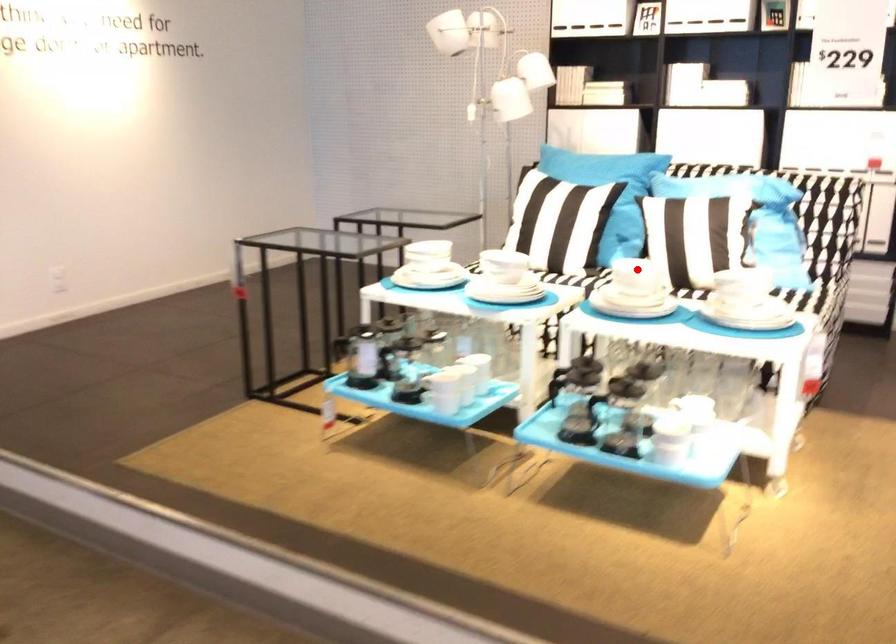
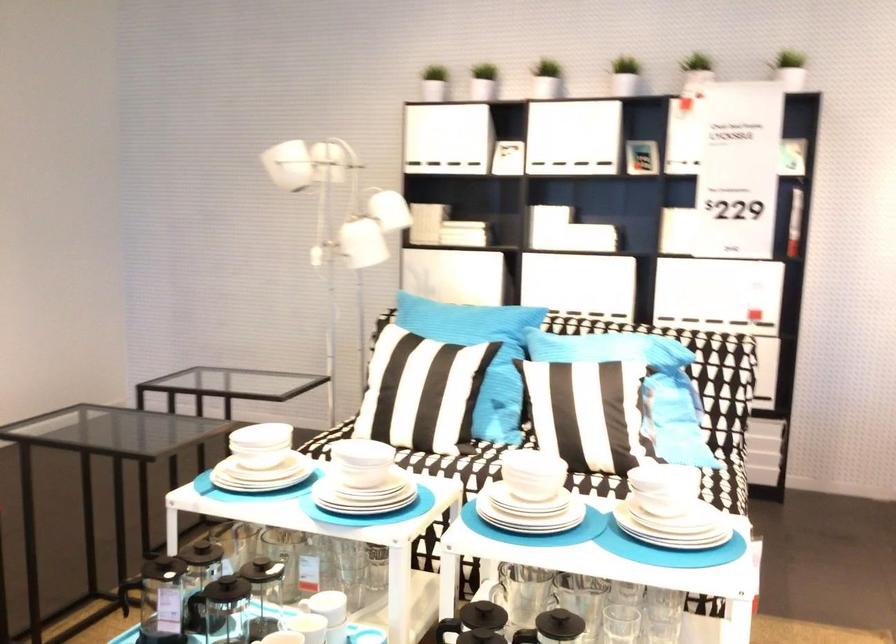
Locate, in the second image, the point that corresponds to the highlighted location in the first image.

(531, 474)